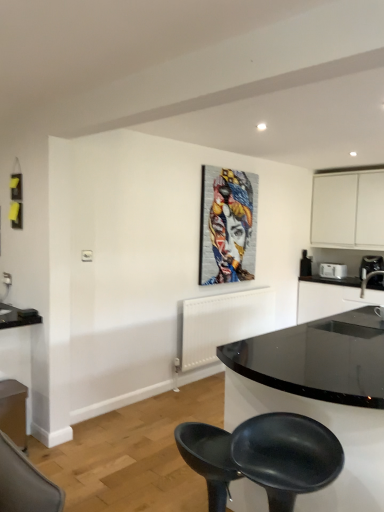
Identify the location of free location above metallic textured painting at center (from a real-world perspective). (232, 167).